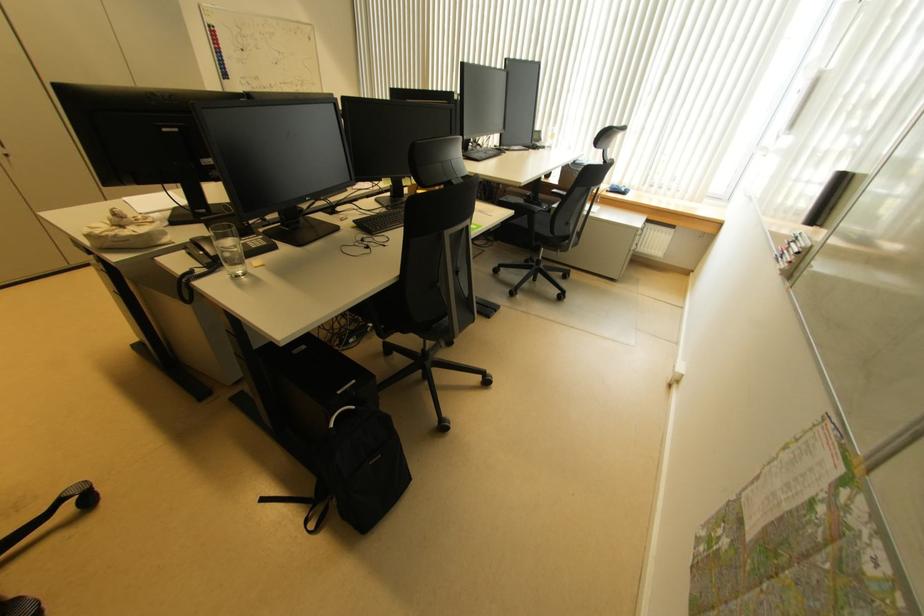
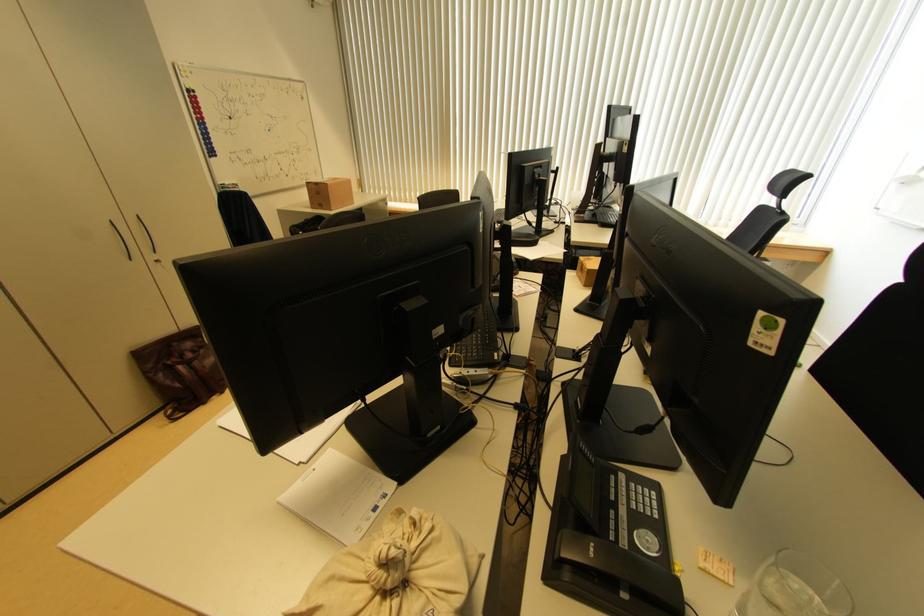
In the second image, find the point that corresponds to (116,229) in the first image.

(387, 597)